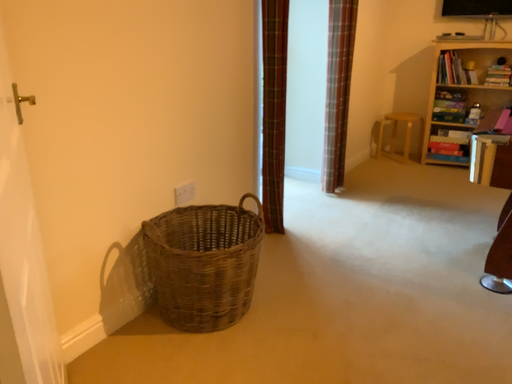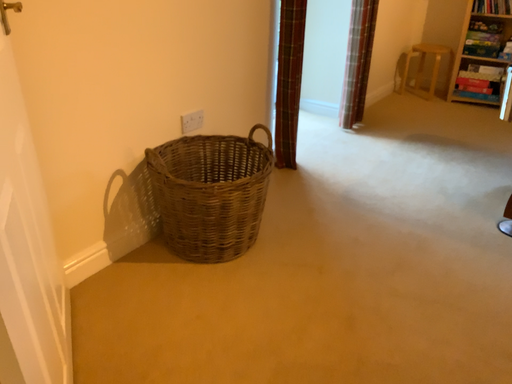
Question: Which way did the camera rotate in the video?

Choices:
 (A) rotated upward
 (B) rotated downward

Answer: (B)